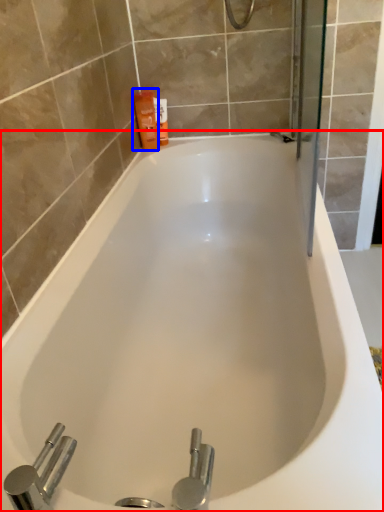
Question: Which of the following is the closest to the observer, bathtub (highlighted by a red box) or toiletry (highlighted by a blue box)?

Choices:
 (A) bathtub
 (B) toiletry

Answer: (A)